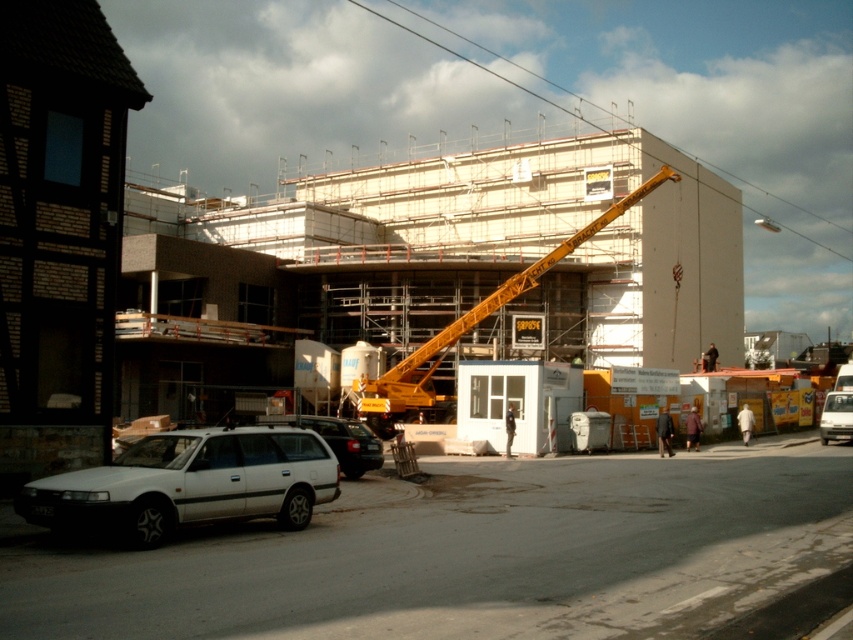
Question: Does yellow metallic crane at center appear under dark blue uniform at center?

Choices:
 (A) yes
 (B) no

Answer: (B)

Question: Among these objects, which one is nearest to the camera?

Choices:
 (A) white matte van at lower right
 (B) dark blue uniform at center
 (C) yellow metallic crane at center
 (D) white matte car at lower left

Answer: (D)

Question: Which is farther from the dark blue uniform at center?

Choices:
 (A) yellow metallic crane at center
 (B) white matte car at lower left
 (C) white matte wagon at lower left

Answer: (C)

Question: Does white matte wagon at lower left have a larger size compared to dark blue uniform at center?

Choices:
 (A) no
 (B) yes

Answer: (B)

Question: Does white matte wagon at lower left have a larger size compared to dark blue uniform at center?

Choices:
 (A) yes
 (B) no

Answer: (A)

Question: Which point is farther from the camera taking this photo?

Choices:
 (A) (503, 426)
 (B) (320, 417)
 (C) (492, 298)

Answer: (C)